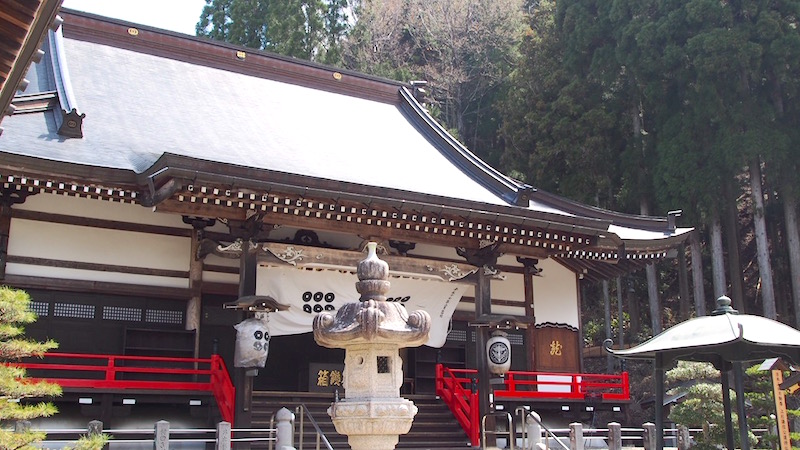
Find the location of a particular element. Image resolution: width=800 pixels, height=450 pixels. stairs is located at coordinates pos(452,443), pos(282,400).